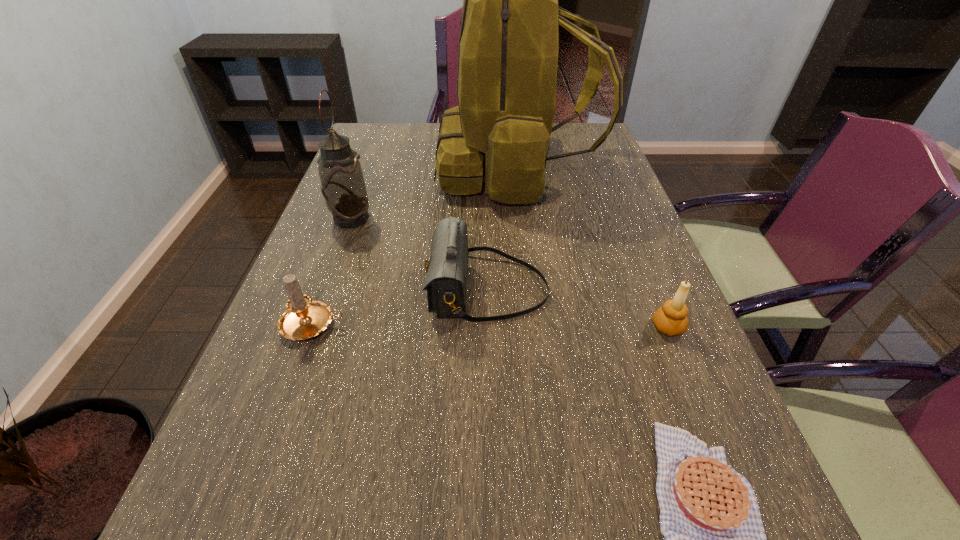
Locate which object is the second closest to the tallest object. Please provide its 2D coordinates. Your answer should be formatted as a tuple, i.e. [(x, y)], where the tuple contains the x and y coordinates of a point satisfying the conditions above.

[(447, 270)]

Where is `free point that satisfies the following two spatial constraints: 1. on the front side of the candle; 2. on the right side of the candle_holder`? This screenshot has width=960, height=540. free point that satisfies the following two spatial constraints: 1. on the front side of the candle; 2. on the right side of the candle_holder is located at coordinates tap(313, 327).

In order to click on free region that satisfies the following two spatial constraints: 1. on the front side of the shoulder bag; 2. on the right side of the second tallest object in this screenshot , I will do `click(325, 289)`.